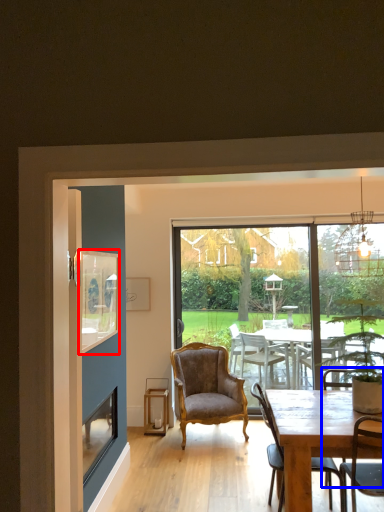
Question: Among these objects, which one is farthest to the camera, window screen (highlighted by a red box) or armchair (highlighted by a blue box)?

Choices:
 (A) window screen
 (B) armchair

Answer: (A)